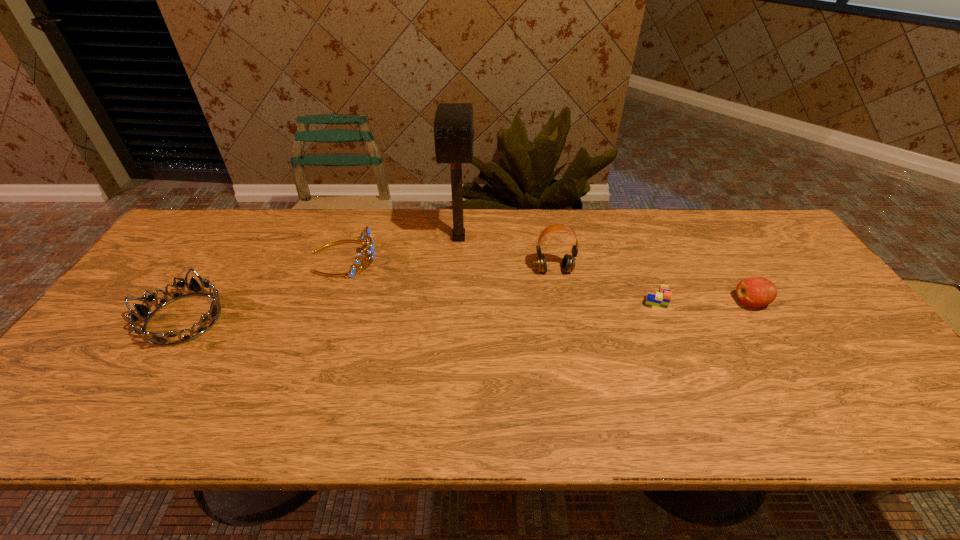
The height and width of the screenshot is (540, 960). Find the location of `free region at the far edge of the desktop`. free region at the far edge of the desktop is located at coordinates (562, 249).

The width and height of the screenshot is (960, 540). What are the coordinates of `free region at the left edge` in the screenshot? It's located at (63, 389).

Where is `blank space at the right edge`? The height and width of the screenshot is (540, 960). blank space at the right edge is located at coordinates (811, 314).

Locate an element on the screen. This screenshot has width=960, height=540. free space between the second tallest object and the shortest object is located at coordinates (606, 285).

Identify the location of free space between the fourth shortest object and the left tiara. The image size is (960, 540). (264, 288).

This screenshot has width=960, height=540. Find the location of `free space that is in between the fourth object from right to left and the rightmost object`. free space that is in between the fourth object from right to left and the rightmost object is located at coordinates (605, 271).

Image resolution: width=960 pixels, height=540 pixels. Identify the location of free space between the third tallest object and the tallest object. (401, 248).

You are a GUI agent. You are given a task and a screenshot of the screen. Output one action in this format:
    pyautogui.click(x=<x>, y=<y>)
    Task: Click on the empty location between the fifth object from right to left and the fourth object from right to left
    Image resolution: width=960 pixels, height=540 pixels.
    Given the screenshot: What is the action you would take?
    pyautogui.click(x=401, y=248)

Locate an element on the screen. free point between the shortest object and the right tiara is located at coordinates (500, 279).

The image size is (960, 540). In order to click on unoccupied position between the fourth object from right to left and the fifth object from right to left in this screenshot , I will do `click(401, 248)`.